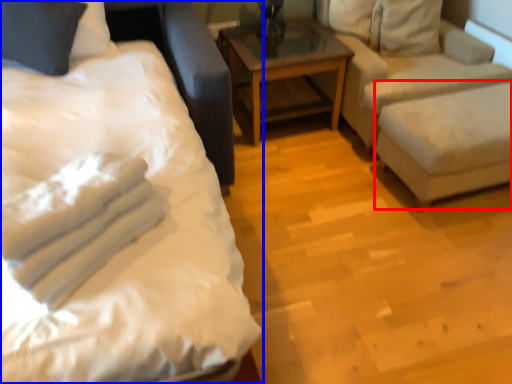
Question: Among these objects, which one is farthest to the camera, swivel chair (highlighted by a red box) or bed (highlighted by a blue box)?

Choices:
 (A) swivel chair
 (B) bed

Answer: (A)